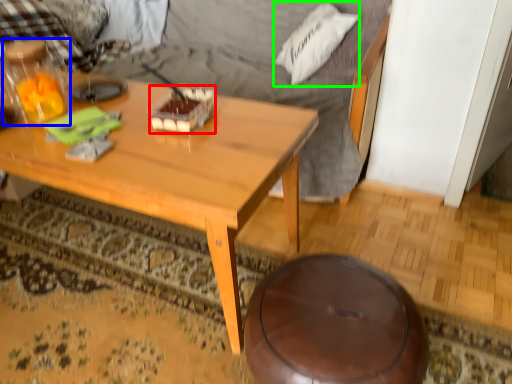
Question: Which object is the closest to the food (highlighted by a red box)? Choose among these: bottle (highlighted by a blue box) or pillow (highlighted by a green box).

Choices:
 (A) bottle
 (B) pillow

Answer: (A)